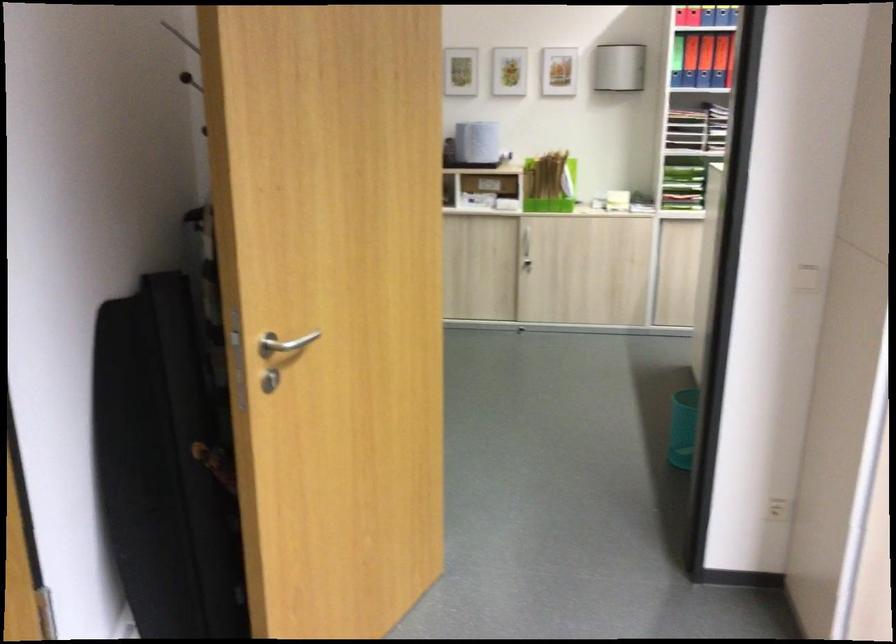
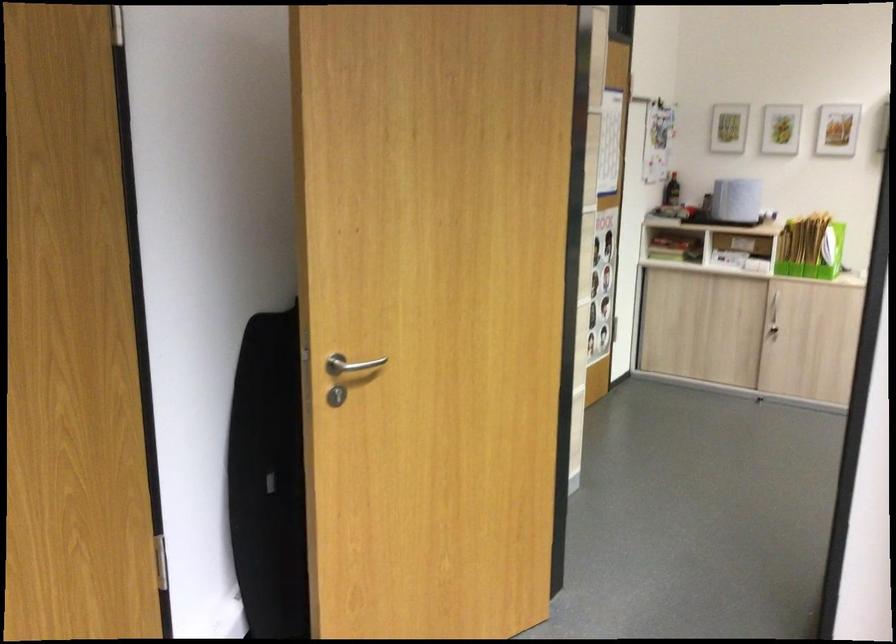
Locate, in the second image, the point that corresponds to (557,184) in the first image.

(810, 247)